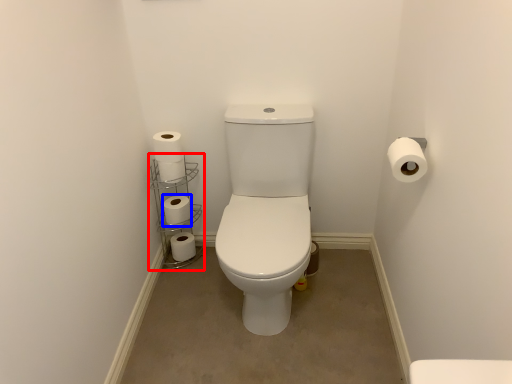
Question: Which object is closer to the camera taking this photo, shelf (highlighted by a red box) or toilet paper (highlighted by a blue box)?

Choices:
 (A) shelf
 (B) toilet paper

Answer: (A)